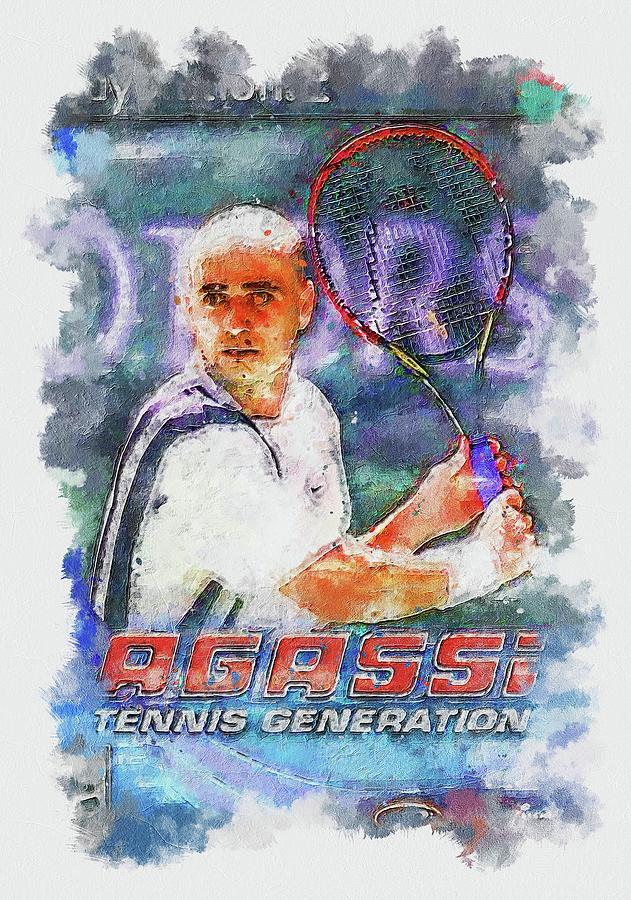
Locate an element on the screen. The image size is (631, 900). white canvas is located at coordinates (40, 61).